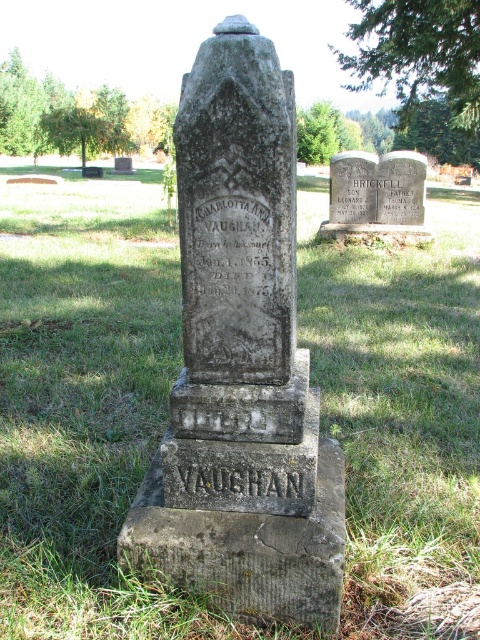
Can you confirm if green grass at center is wider than smooth gray stone at center?

Correct, the width of green grass at center exceeds that of smooth gray stone at center.

Which is below, green grass at center or smooth gray stone at center?

green grass at center

Image resolution: width=480 pixels, height=640 pixels. I want to click on green grass at center, so click(x=85, y=403).

Is gray stone gravestone at center smaller than smooth gray stone at center?

No.

You are a GUI agent. You are given a task and a screenshot of the screen. Output one action in this format:
    pyautogui.click(x=<x>, y=<y>)
    Task: Click on the gray stone gravestone at center
    
    Given the screenshot: What is the action you would take?
    pyautogui.click(x=241, y=364)

Which is above, green grass at center or gray stone gravestone at center?

green grass at center

Identify the location of green grass at center. This screenshot has width=480, height=640. (85, 403).